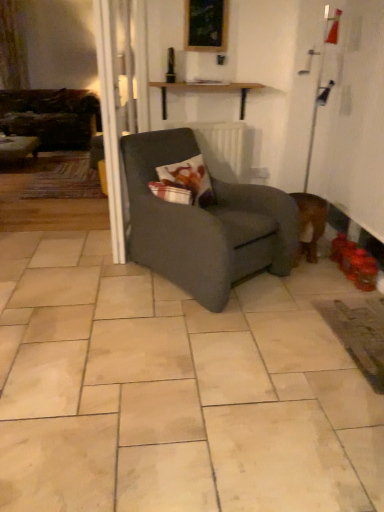
Question: Are printed fabric pillow at center and velvet dark brown couch at left located far from each other?

Choices:
 (A) yes
 (B) no

Answer: (A)

Question: Can you confirm if printed fabric pillow at center is thinner than velvet dark brown couch at left?

Choices:
 (A) yes
 (B) no

Answer: (A)

Question: Does printed fabric pillow at center have a greater width compared to velvet dark brown couch at left?

Choices:
 (A) no
 (B) yes

Answer: (A)

Question: From the image's perspective, would you say printed fabric pillow at center is positioned over velvet dark brown couch at left?

Choices:
 (A) yes
 (B) no

Answer: (B)

Question: Does printed fabric pillow at center have a larger size compared to velvet dark brown couch at left?

Choices:
 (A) yes
 (B) no

Answer: (B)

Question: Is wooden picture frame at upper center wider or thinner than velvet dark brown couch at left?

Choices:
 (A) thin
 (B) wide

Answer: (A)

Question: Is wooden picture frame at upper center inside the boundaries of velvet dark brown couch at left, or outside?

Choices:
 (A) inside
 (B) outside

Answer: (B)

Question: Considering the positions of point (226, 44) and point (29, 103), is point (226, 44) closer or farther from the camera than point (29, 103)?

Choices:
 (A) farther
 (B) closer

Answer: (B)

Question: Looking at the image, does wooden picture frame at upper center seem bigger or smaller compared to velvet dark brown couch at left?

Choices:
 (A) small
 (B) big

Answer: (A)

Question: Considering the positions of matte wooden table at left, which ranks as the first table in back-to-front order, and wooden shelf at upper center, placed as the second table when sorted from left to right, in the image, is matte wooden table at left, which ranks as the first table in back-to-front order, wider or thinner than wooden shelf at upper center, placed as the second table when sorted from left to right,?

Choices:
 (A) thin
 (B) wide

Answer: (B)

Question: Is matte wooden table at left, which ranks as the first table in back-to-front order, inside or outside of wooden shelf at upper center, which is the first table from front to back?

Choices:
 (A) inside
 (B) outside

Answer: (B)

Question: From their relative heights in the image, would you say matte wooden table at left, which appears as the 1th table when viewed from the left, is taller or shorter than wooden shelf at upper center, which is the first table from front to back?

Choices:
 (A) short
 (B) tall

Answer: (B)

Question: Considering the positions of matte wooden table at left, acting as the second table starting from the right, and wooden shelf at upper center, which is the 1th table in right-to-left order, in the image, is matte wooden table at left, acting as the second table starting from the right, bigger or smaller than wooden shelf at upper center, which is the 1th table in right-to-left order,?

Choices:
 (A) big
 (B) small

Answer: (A)

Question: From a real-world perspective, relative to velvet dark brown couch at left, is printed fabric pillow at center vertically above or below?

Choices:
 (A) above
 (B) below

Answer: (A)

Question: From their relative heights in the image, would you say printed fabric pillow at center is taller or shorter than velvet dark brown couch at left?

Choices:
 (A) short
 (B) tall

Answer: (A)